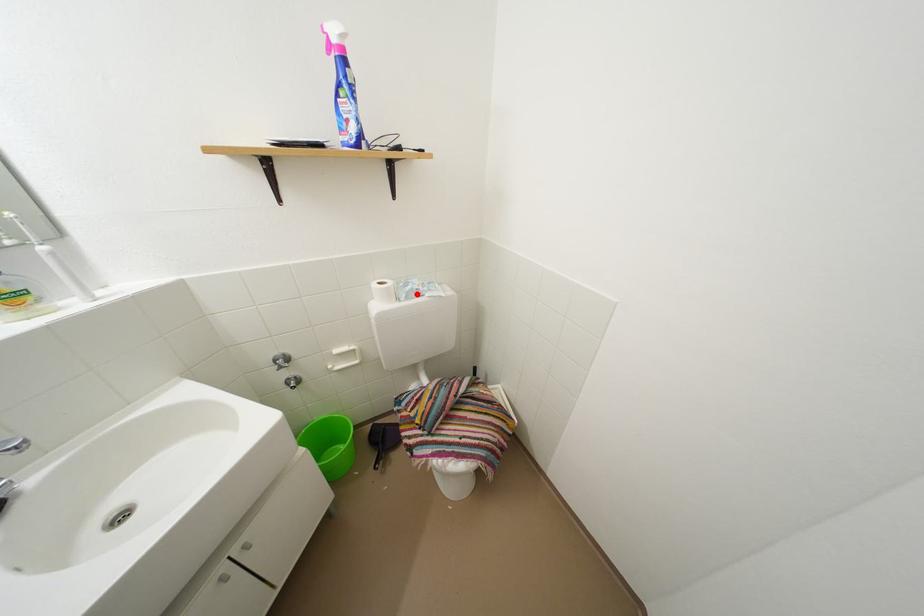
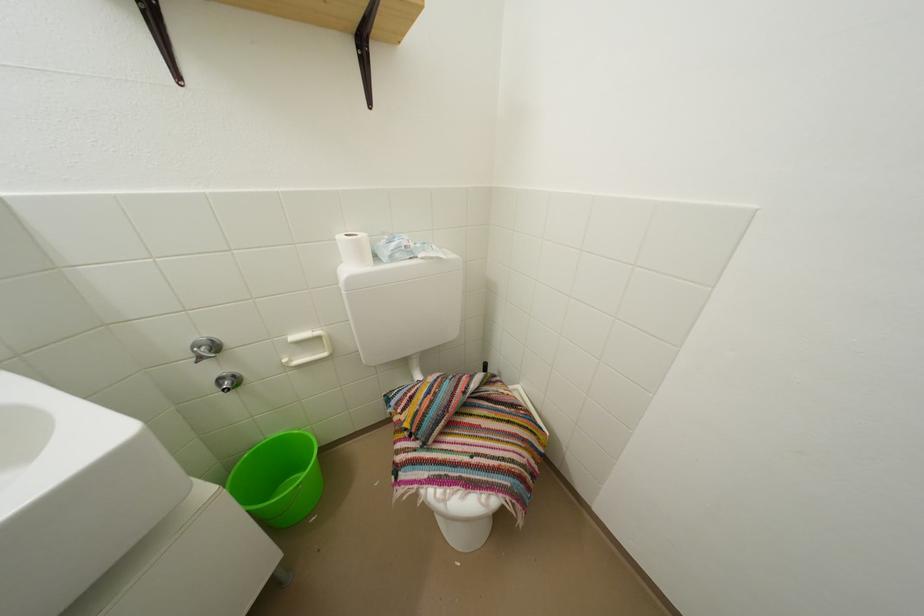
The point at the highlighted location is marked in the first image. Where is the corresponding point in the second image?

(402, 251)